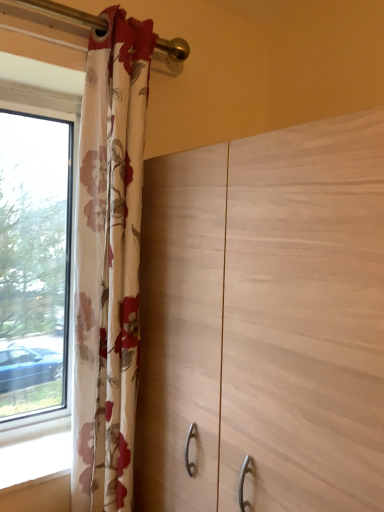
Question: From a real-world perspective, is floral fabric curtain at left physically located above or below light wood dresser at center?

Choices:
 (A) above
 (B) below

Answer: (A)

Question: Does point (122, 94) appear closer or farther from the camera than point (306, 502)?

Choices:
 (A) farther
 (B) closer

Answer: (A)

Question: Would you say floral fabric curtain at left is to the left or to the right of light wood dresser at center in the picture?

Choices:
 (A) left
 (B) right

Answer: (A)

Question: Considering the positions of light wood dresser at center and floral fabric curtain at left in the image, is light wood dresser at center taller or shorter than floral fabric curtain at left?

Choices:
 (A) short
 (B) tall

Answer: (A)

Question: Based on their sizes in the image, would you say light wood dresser at center is bigger or smaller than floral fabric curtain at left?

Choices:
 (A) small
 (B) big

Answer: (B)

Question: Is point (324, 389) closer or farther from the camera than point (117, 359)?

Choices:
 (A) closer
 (B) farther

Answer: (A)

Question: Considering the relative positions of light wood dresser at center and floral fabric curtain at left in the image provided, is light wood dresser at center to the left or to the right of floral fabric curtain at left?

Choices:
 (A) left
 (B) right

Answer: (B)